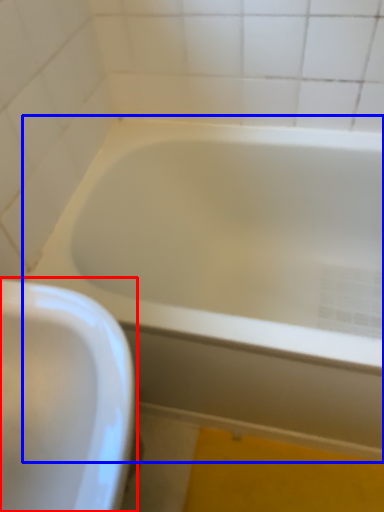
Question: Which object is further to the camera taking this photo, sink (highlighted by a red box) or bathtub (highlighted by a blue box)?

Choices:
 (A) sink
 (B) bathtub

Answer: (B)